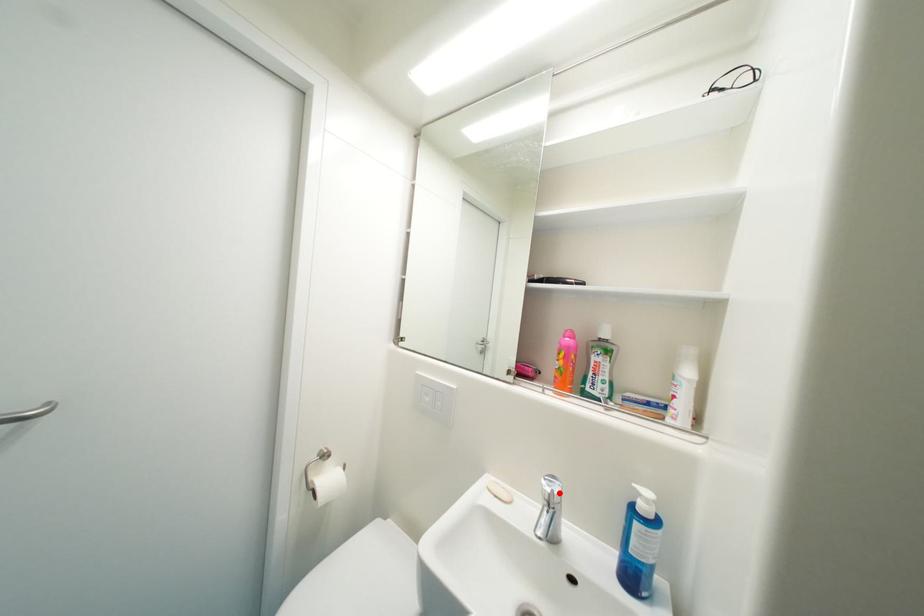
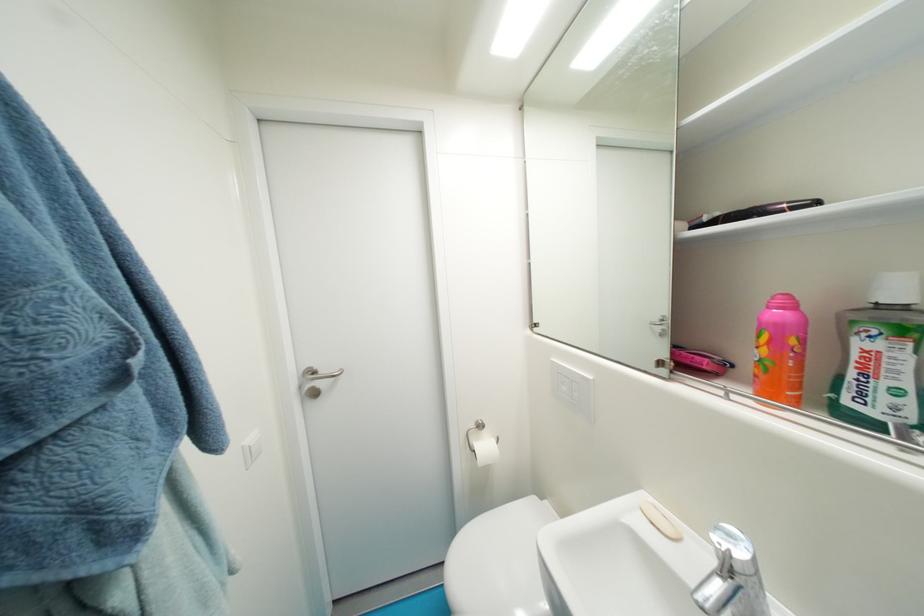
Locate, in the second image, the point that corresponds to the highlighted location in the first image.

(736, 553)